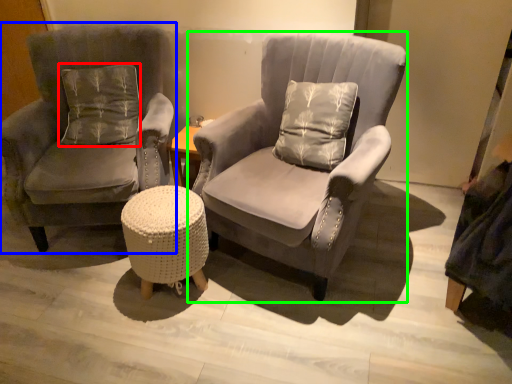
Question: Which object is positioned farthest from pillow (highlighted by a red box)? Select from chair (highlighted by a blue box) and chair (highlighted by a green box).

Choices:
 (A) chair
 (B) chair

Answer: (B)